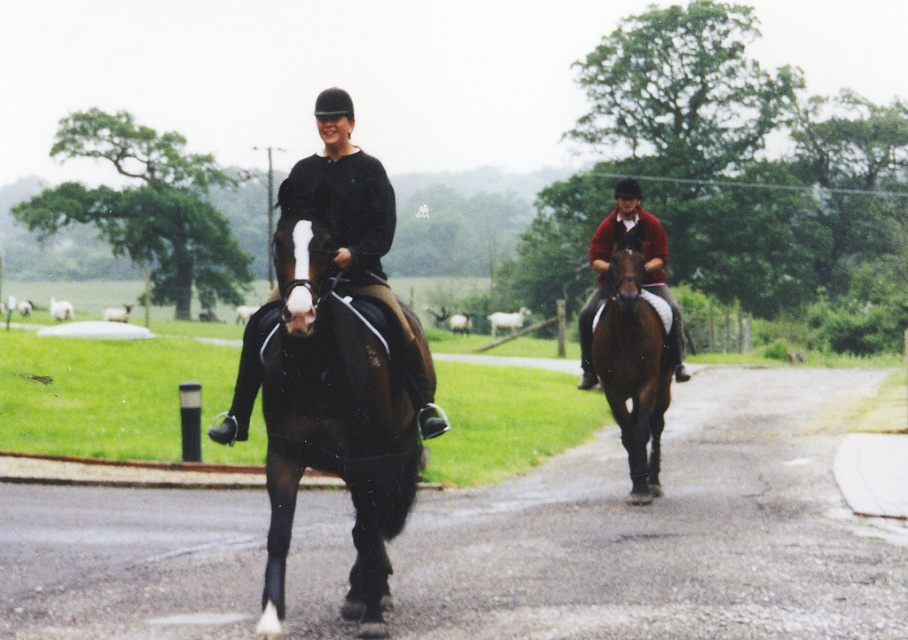
Question: Is black leather jacket at center behind brown glossy horse at center?

Choices:
 (A) no
 (B) yes

Answer: (A)

Question: Does shiny dark brown horse at center have a larger size compared to red woolen sweater at center?

Choices:
 (A) yes
 (B) no

Answer: (B)

Question: Is shiny dark brown horse at center below brown glossy horse at center?

Choices:
 (A) yes
 (B) no

Answer: (A)

Question: Which point is closer to the camera?

Choices:
 (A) (242, 429)
 (B) (307, 428)

Answer: (B)

Question: Considering the real-world distances, which object is farthest from the brown glossy horse at center?

Choices:
 (A) red woolen sweater at center
 (B) shiny dark brown horse at center

Answer: (B)

Question: Which of the following is the closest to the observer?

Choices:
 (A) brown glossy horse at center
 (B) red woolen sweater at center
 (C) shiny dark brown horse at center

Answer: (C)